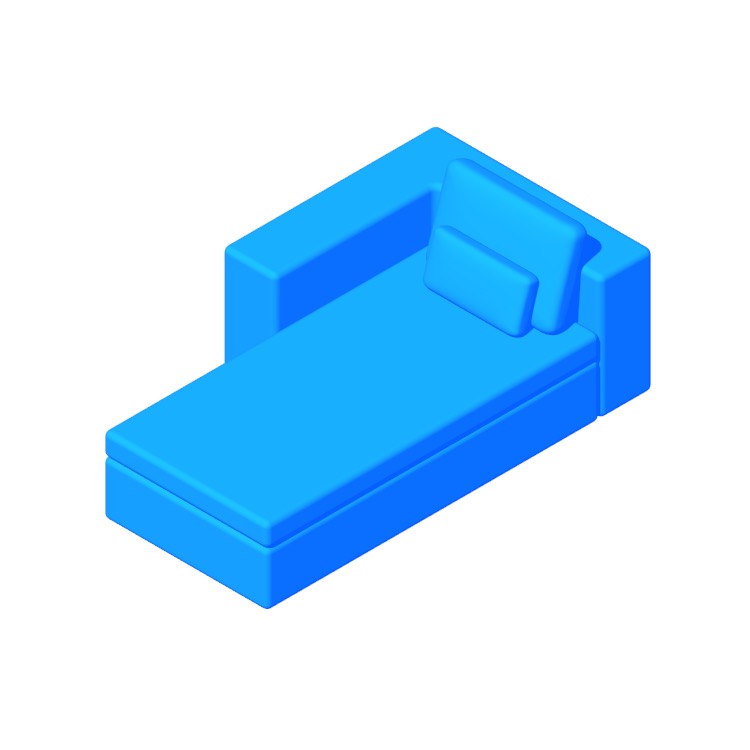
Locate an element on the screen. space below couch is located at coordinates (220, 627).